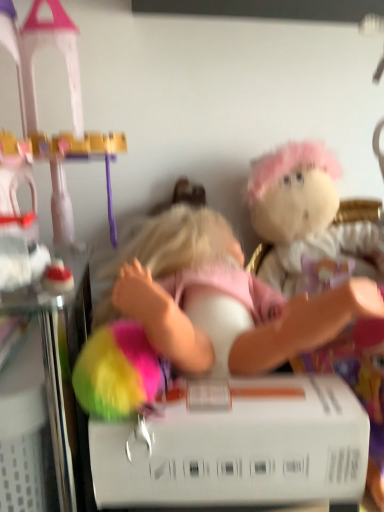
Question: From a real-world perspective, relative to fluffy white plush at upper right, is pink fabric doll at center vertically above or below?

Choices:
 (A) below
 (B) above

Answer: (A)

Question: Is pink fabric doll at center situated inside fluffy white plush at upper right or outside?

Choices:
 (A) inside
 (B) outside

Answer: (B)

Question: Estimate the real-world distances between objects in this image. Which object is farther from the pink fabric doll at center?

Choices:
 (A) white matte box at center
 (B) fluffy white plush at upper right

Answer: (B)

Question: Estimate the real-world distances between objects in this image. Which object is farther from the white matte box at center?

Choices:
 (A) fluffy white plush at upper right
 (B) pink fabric doll at center

Answer: (A)